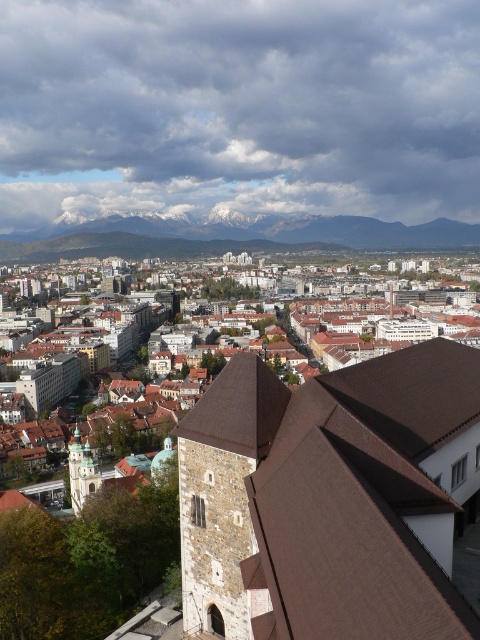
Question: Which object is farther from the camera taking this photo?

Choices:
 (A) stone tower at center
 (B) golden stone tower at center

Answer: (B)

Question: Which point is closer to the camera?

Choices:
 (A) golden stone tower at center
 (B) white snow-covered mountain at upper center
 (C) stone tower at center
 (D) brown tiled roof at center

Answer: (C)

Question: Can you confirm if white snow-covered mountain at upper center is positioned to the right of golden stone tower at center?

Choices:
 (A) no
 (B) yes

Answer: (B)

Question: Among these points, which one is farthest from the camera?

Choices:
 (A) (21, 250)
 (B) (84, 468)

Answer: (A)

Question: Can you confirm if brown tiled roof at center is smaller than golden stone tower at center?

Choices:
 (A) yes
 (B) no

Answer: (B)

Question: Does stone tower at center have a larger size compared to white snow-covered mountain at upper center?

Choices:
 (A) yes
 (B) no

Answer: (B)